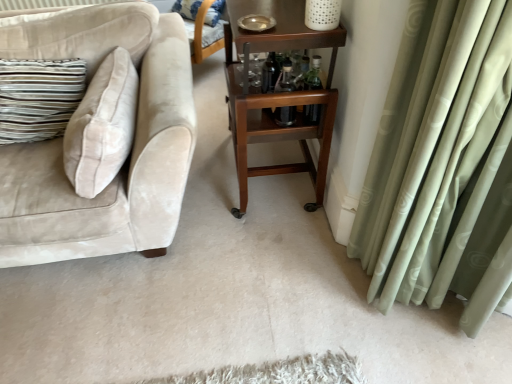
Question: Is striped fabric pillow at upper center bigger than clear glass bottles at center, arranged as the second bottle when viewed from the left?

Choices:
 (A) yes
 (B) no

Answer: (A)

Question: Is striped fabric pillow at upper center thinner than clear glass bottles at center, arranged as the second bottle when viewed from the left?

Choices:
 (A) no
 (B) yes

Answer: (A)

Question: Does striped fabric pillow at upper center have a greater width compared to clear glass bottles at center, arranged as the second bottle when viewed from the left?

Choices:
 (A) no
 (B) yes

Answer: (B)

Question: Is striped fabric pillow at upper center aimed at clear glass bottles at center, arranged as the second bottle when viewed from the left?

Choices:
 (A) no
 (B) yes

Answer: (A)

Question: Can you confirm if striped fabric pillow at upper center is positioned to the right of clear glass bottles at center, arranged as the second bottle when viewed from the left?

Choices:
 (A) yes
 (B) no

Answer: (B)

Question: From a real-world perspective, is transparent glass bottle at center, acting as the first bottle starting from the left, above or below striped fabric pillow at upper center?

Choices:
 (A) above
 (B) below

Answer: (A)

Question: Visually, is transparent glass bottle at center, acting as the first bottle starting from the left, positioned to the left or to the right of striped fabric pillow at upper center?

Choices:
 (A) right
 (B) left

Answer: (A)

Question: In the image, is transparent glass bottle at center, the 2th bottle positioned from the right, positioned in front of or behind striped fabric pillow at upper center?

Choices:
 (A) behind
 (B) front

Answer: (B)

Question: Would you say transparent glass bottle at center, acting as the first bottle starting from the left, is inside or outside striped fabric pillow at upper center?

Choices:
 (A) inside
 (B) outside

Answer: (B)

Question: From a real-world perspective, is beige velvet couch at left positioned above or below clear glass bottles at center, marked as the 1th bottle in a right-to-left arrangement?

Choices:
 (A) above
 (B) below

Answer: (B)

Question: Is beige velvet couch at left to the left or to the right of clear glass bottles at center, marked as the 1th bottle in a right-to-left arrangement, in the image?

Choices:
 (A) left
 (B) right

Answer: (A)

Question: In terms of height, does beige velvet couch at left look taller or shorter compared to clear glass bottles at center, marked as the 1th bottle in a right-to-left arrangement?

Choices:
 (A) short
 (B) tall

Answer: (B)

Question: Is beige velvet couch at left inside the boundaries of clear glass bottles at center, marked as the 1th bottle in a right-to-left arrangement, or outside?

Choices:
 (A) inside
 (B) outside

Answer: (B)

Question: From the image's perspective, relative to transparent glass bottle at center, acting as the first bottle starting from the left, is wooden rolling cart at center above or below?

Choices:
 (A) above
 (B) below

Answer: (A)

Question: Is wooden rolling cart at center taller or shorter than transparent glass bottle at center, the 2th bottle positioned from the right?

Choices:
 (A) tall
 (B) short

Answer: (A)